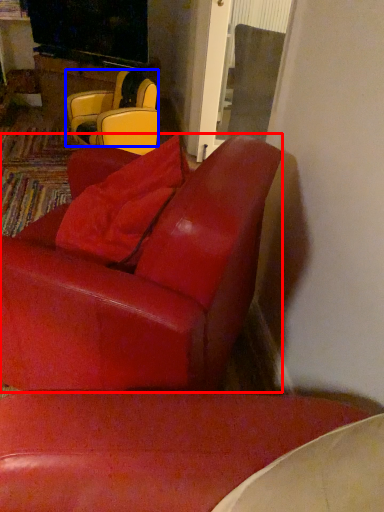
Question: Which object is further to the camera taking this photo, chair (highlighted by a red box) or chair (highlighted by a blue box)?

Choices:
 (A) chair
 (B) chair

Answer: (B)